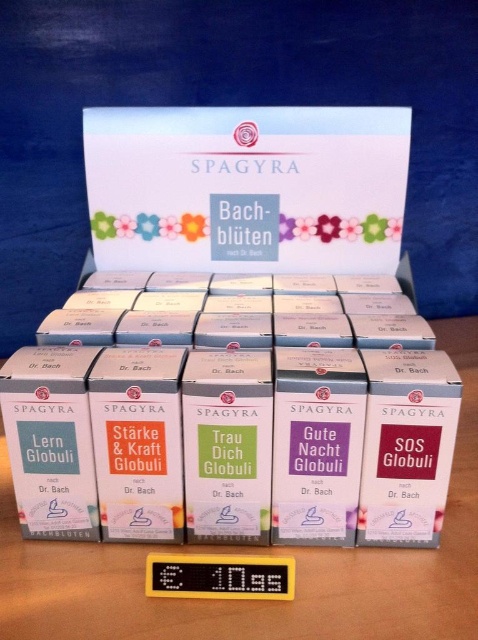
Is white cardboard box at center closer to camera compared to white cardboard boxes at center?

No, white cardboard box at center is behind white cardboard boxes at center.

Is white cardboard box at center below white cardboard boxes at center?

No.

Does point (125, 172) come closer to viewer compared to point (474, 460)?

No.

Locate an element on the screen. The image size is (478, 640). white cardboard box at center is located at coordinates (247, 188).